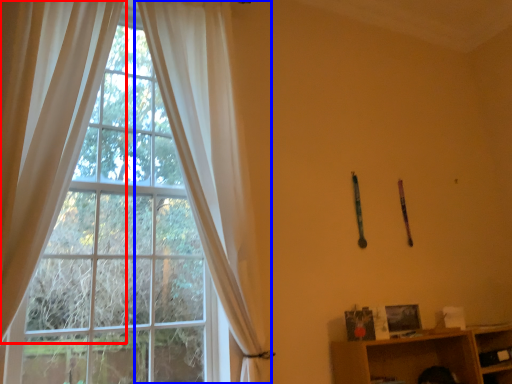
Question: Which object is closer to the camera taking this photo, curtain (highlighted by a red box) or curtain (highlighted by a blue box)?

Choices:
 (A) curtain
 (B) curtain

Answer: (A)